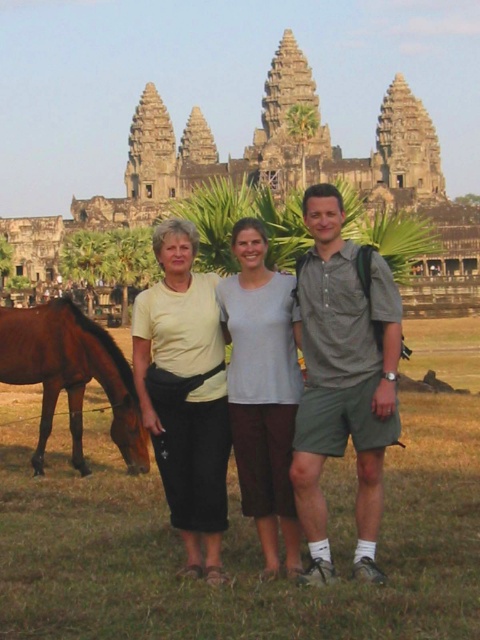
Who is lower down, light yellow cotton shirt at center or matte gray shirt at center?

light yellow cotton shirt at center

In the scene shown: Can you confirm if light yellow cotton shirt at center is positioned to the left of matte gray shirt at center?

Correct, you'll find light yellow cotton shirt at center to the left of matte gray shirt at center.

At what (x,y) coordinates should I click in order to perform the action: click on light yellow cotton shirt at center. Please return your answer as a coordinate pair (x, y). Looking at the image, I should click on (343, 376).

Find the location of a particular element. light yellow cotton shirt at center is located at coordinates (343, 376).

Does light yellow cotton shirt at center have a greater height compared to light gray cotton shirt at center?

Yes, light yellow cotton shirt at center is taller than light gray cotton shirt at center.

What do you see at coordinates (343, 376) in the screenshot?
I see `light yellow cotton shirt at center` at bounding box center [343, 376].

This screenshot has width=480, height=640. What do you see at coordinates (343, 376) in the screenshot?
I see `light yellow cotton shirt at center` at bounding box center [343, 376].

I want to click on light yellow cotton shirt at center, so point(343,376).

Is light yellow cotton shirt at center bigger than brown glossy horse at lower left?

Yes, light yellow cotton shirt at center is bigger than brown glossy horse at lower left.

Based on the photo, can you confirm if light yellow cotton shirt at center is wider than brown glossy horse at lower left?

Indeed, light yellow cotton shirt at center has a greater width compared to brown glossy horse at lower left.

Between point (323, 524) and point (79, 468), which one is positioned behind?

Positioned behind is point (79, 468).

I want to click on light yellow cotton shirt at center, so click(343, 376).